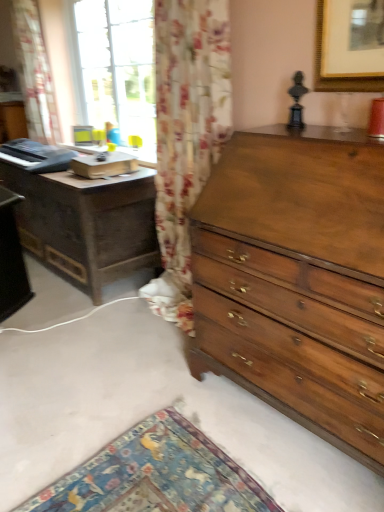
Identify the location of vacant region to the left of shiny brown wood chest of drawers at right. (149, 410).